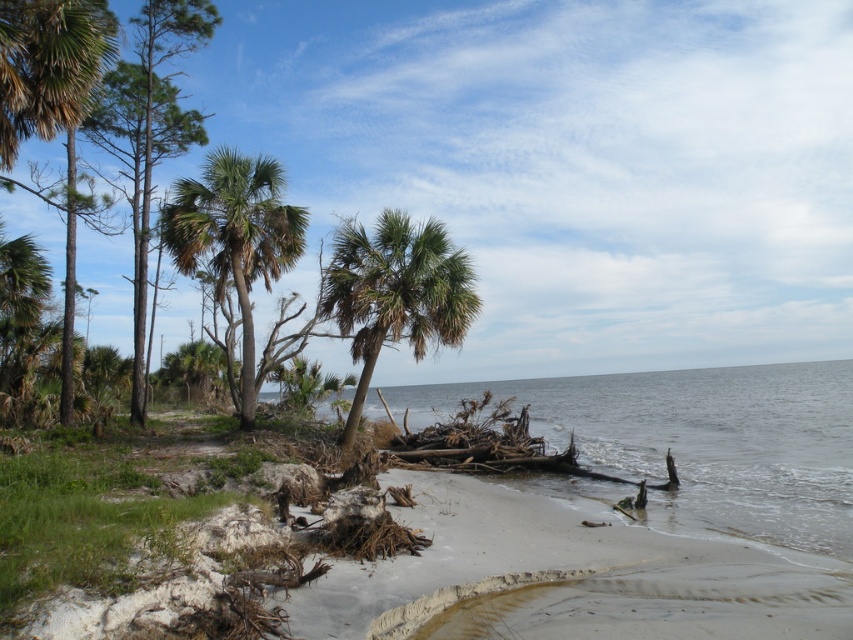
You are standing on the beach and want to walk to the two points marked in the image. Which point, point (384, 588) or point (372, 262), is closer to you?

Point (384, 588) is closer to the viewer than point (372, 262), so you should walk to point (384, 588) first.